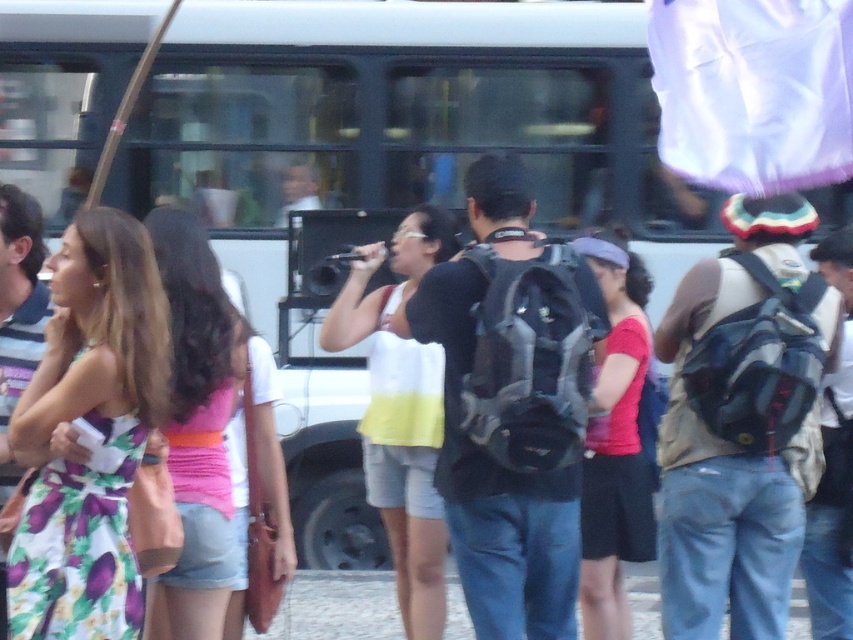
Question: Can you confirm if floral dress at left is smaller than pink fabric top at center?

Choices:
 (A) no
 (B) yes

Answer: (B)

Question: Which point is closer to the camera?

Choices:
 (A) (582, 540)
 (B) (183, 236)
 (C) (57, 314)

Answer: (C)

Question: Among these points, which one is farthest from the camera?

Choices:
 (A) (194, 547)
 (B) (606, 280)

Answer: (B)

Question: Which of the following is the farthest from the observer?

Choices:
 (A) (581, 609)
 (B) (62, 540)
 (C) (175, 228)
 (D) (422, 234)

Answer: (D)

Question: Can you confirm if pink fabric top at center is positioned to the left of matte red shirt at center?

Choices:
 (A) yes
 (B) no

Answer: (A)

Question: Does pink fabric top at center have a lesser width compared to matte red shirt at center?

Choices:
 (A) no
 (B) yes

Answer: (A)